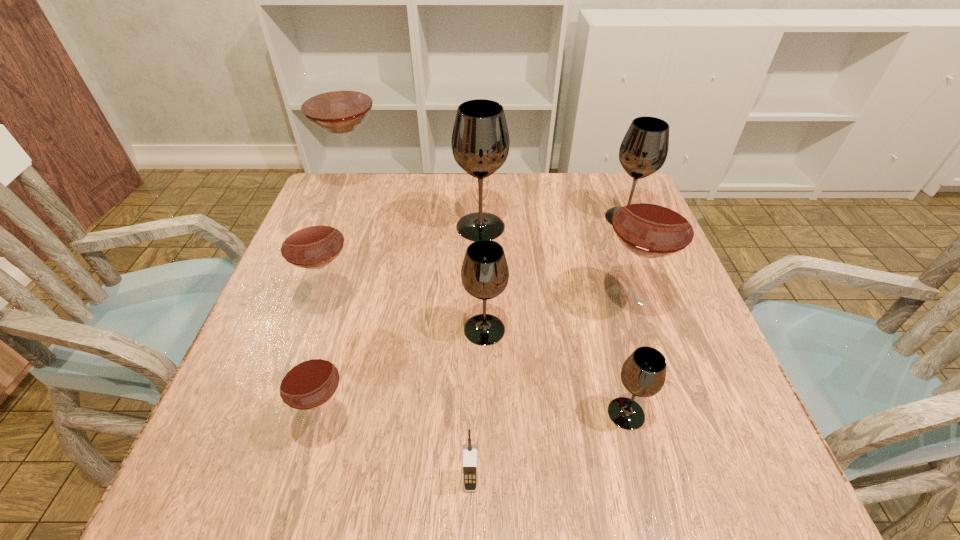
In order to click on free space located on the front of the farthest red wineglass in this screenshot , I will do `click(326, 271)`.

Identify the location of free space located 0.310m on the front of the biggest gray wineglass. (481, 345).

Identify the location of free space located on the left of the second biggest gray wineglass. (527, 218).

Image resolution: width=960 pixels, height=540 pixels. Identify the location of vacant space located 0.130m on the back of the rightmost red wineglass. (608, 241).

Where is `vacant area situated 0.140m on the front of the second smallest red wineglass`? vacant area situated 0.140m on the front of the second smallest red wineglass is located at coordinates (305, 386).

Identify the location of free space located on the left of the second smallest gray wineglass. The height and width of the screenshot is (540, 960). (402, 329).

Locate an element on the screen. free spot located 0.060m on the left of the smallest red wineglass is located at coordinates (267, 424).

At what (x,y) coordinates should I click in order to perform the action: click on free point located on the back of the second gray wineglass from right to left. Please return your answer as a coordinate pair (x, y). This screenshot has width=960, height=540. Looking at the image, I should click on (609, 346).

What are the coordinates of `wineglass located at the near edge` in the screenshot? It's located at (306, 379).

In order to click on cellular telephone that is at the near edge in this screenshot , I will do `click(469, 464)`.